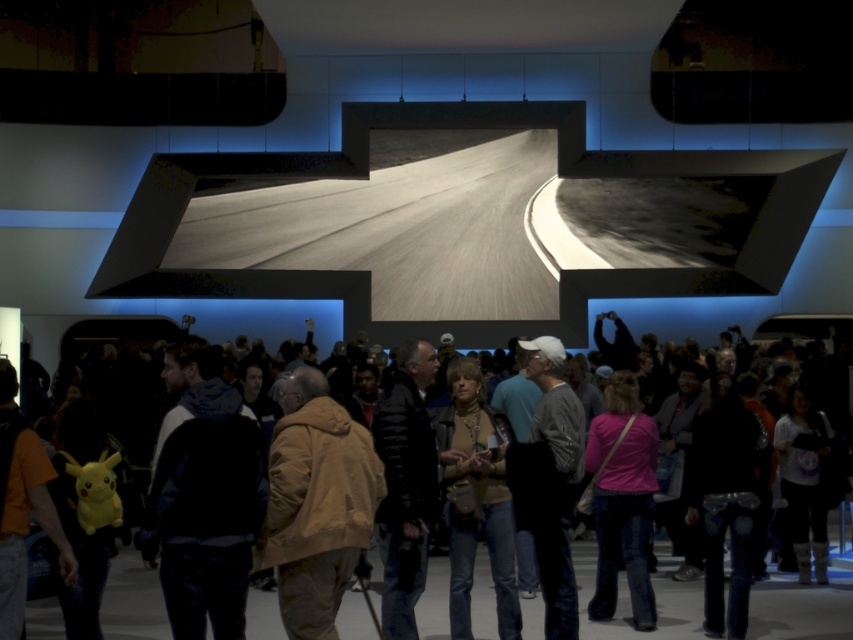
You are an attendee at the event and want to take a photo of both the dark blue hoodie at center and the pink fabric shirt at center. Since the lighting is dim, you need to adjust your camera settings. Which object should you focus on first to ensure both are in the frame?

The dark blue hoodie at center is located above the pink fabric shirt at center, so you should focus on the dark blue hoodie at center first to ensure both are in the frame.

You are an attendee at the event and want to take a photo of both the brown leather jacket at center and the black leather jacket at center. Since the lighting is dim, you need to ensure both jackets are fully visible in the photo. Which jacket might be easier to capture clearly due to its size?

The black leather jacket at center is taller than the brown leather jacket at center, so it might be easier to capture clearly in the dim lighting because its larger size can better utilize the available light.